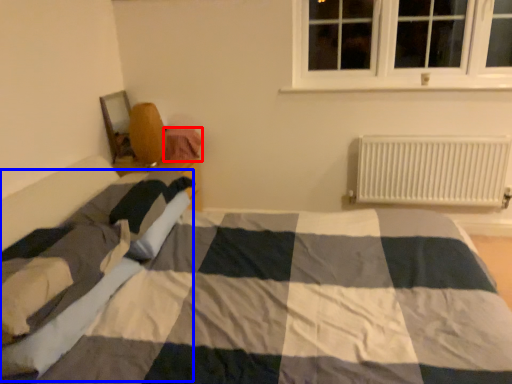
Question: Which object appears farthest to the camera in this image, material (highlighted by a red box) or blanket (highlighted by a blue box)?

Choices:
 (A) material
 (B) blanket

Answer: (A)